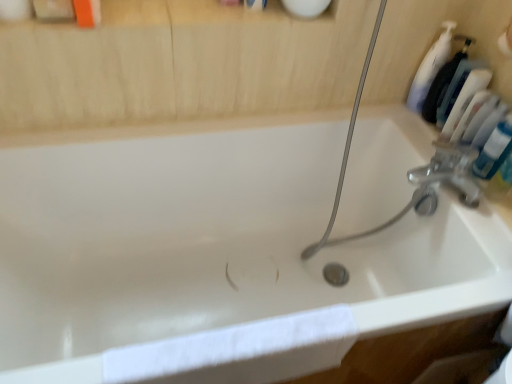
Question: Is white plastic bottle at upper right completely or partially outside of white cotton towel at lower left?

Choices:
 (A) no
 (B) yes

Answer: (B)

Question: Is white plastic bottle at upper right wider than white cotton towel at lower left?

Choices:
 (A) no
 (B) yes

Answer: (A)

Question: Is white plastic bottle at upper right far from white cotton towel at lower left?

Choices:
 (A) no
 (B) yes

Answer: (A)

Question: From the image's perspective, is white plastic bottle at upper right under white cotton towel at lower left?

Choices:
 (A) no
 (B) yes

Answer: (A)

Question: Does white plastic bottle at upper right turn towards white cotton towel at lower left?

Choices:
 (A) no
 (B) yes

Answer: (A)

Question: Considering the positions of white plastic bottle at upper right and blue glossy tube at upper right in the image, is white plastic bottle at upper right bigger or smaller than blue glossy tube at upper right?

Choices:
 (A) big
 (B) small

Answer: (A)

Question: From their relative heights in the image, would you say white plastic bottle at upper right is taller or shorter than blue glossy tube at upper right?

Choices:
 (A) short
 (B) tall

Answer: (B)

Question: Does point (420, 77) appear closer or farther from the camera than point (498, 167)?

Choices:
 (A) farther
 (B) closer

Answer: (A)

Question: From the image's perspective, is white plastic bottle at upper right positioned above or below blue glossy tube at upper right?

Choices:
 (A) above
 (B) below

Answer: (A)

Question: In the image, is white cotton towel at lower left on the left side or the right side of blue glossy tube at upper right?

Choices:
 (A) right
 (B) left

Answer: (B)

Question: From the image's perspective, relative to blue glossy tube at upper right, is white cotton towel at lower left above or below?

Choices:
 (A) above
 (B) below

Answer: (B)

Question: Considering the positions of white cotton towel at lower left and blue glossy tube at upper right in the image, is white cotton towel at lower left bigger or smaller than blue glossy tube at upper right?

Choices:
 (A) big
 (B) small

Answer: (A)

Question: Does point (105, 362) appear closer or farther from the camera than point (482, 155)?

Choices:
 (A) farther
 (B) closer

Answer: (B)

Question: In the image, is blue glossy tube at upper right on the left side or the right side of white plastic bottle at upper right?

Choices:
 (A) left
 (B) right

Answer: (B)

Question: In terms of height, does blue glossy tube at upper right look taller or shorter compared to white plastic bottle at upper right?

Choices:
 (A) short
 (B) tall

Answer: (A)